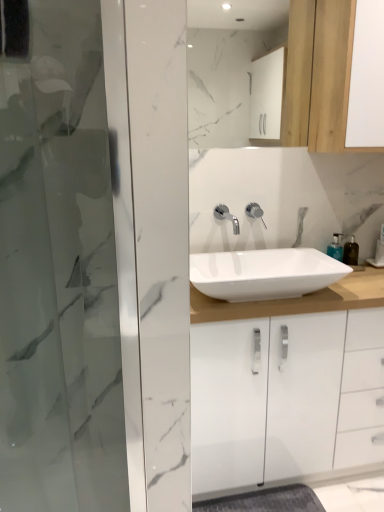
Question: Is white glossy sink at center thinner than polished chrome faucet at center, which ranks as the second tap in right-to-left order?

Choices:
 (A) no
 (B) yes

Answer: (A)

Question: Is white glossy sink at center to the right of polished chrome faucet at center, the first tap from the left, from the viewer's perspective?

Choices:
 (A) no
 (B) yes

Answer: (B)

Question: Considering the relative sizes of white glossy sink at center and polished chrome faucet at center, which ranks as the second tap in right-to-left order, in the image provided, is white glossy sink at center shorter than polished chrome faucet at center, which ranks as the second tap in right-to-left order,?

Choices:
 (A) yes
 (B) no

Answer: (A)

Question: Is white glossy sink at center bigger than polished chrome faucet at center, the first tap from the left?

Choices:
 (A) yes
 (B) no

Answer: (A)

Question: Would you say polished chrome faucet at center, the first tap from the left, is part of white glossy sink at center's contents?

Choices:
 (A) yes
 (B) no

Answer: (B)

Question: Is polished chrome faucet at center, arranged as the 1th tap when viewed from the right, inside the boundaries of white marble mirror at upper center, or outside?

Choices:
 (A) outside
 (B) inside

Answer: (A)

Question: Considering the relative positions of polished chrome faucet at center, arranged as the 1th tap when viewed from the right, and white marble mirror at upper center in the image provided, is polished chrome faucet at center, arranged as the 1th tap when viewed from the right, to the left or to the right of white marble mirror at upper center?

Choices:
 (A) left
 (B) right

Answer: (B)

Question: From a real-world perspective, is polished chrome faucet at center, arranged as the 1th tap when viewed from the right, physically located above or below white marble mirror at upper center?

Choices:
 (A) above
 (B) below

Answer: (B)

Question: From the image's perspective, is polished chrome faucet at center, arranged as the 1th tap when viewed from the right, above or below white marble mirror at upper center?

Choices:
 (A) above
 (B) below

Answer: (B)

Question: In terms of width, does translucent plastic soap dispenser at right, which is counted as the second soap dispenser, starting from the right, look wider or thinner when compared to white marble mirror at upper center?

Choices:
 (A) thin
 (B) wide

Answer: (B)

Question: In the image, is translucent plastic soap dispenser at right, which is counted as the second soap dispenser, starting from the right, positioned in front of or behind white marble mirror at upper center?

Choices:
 (A) behind
 (B) front

Answer: (A)

Question: From a real-world perspective, is translucent plastic soap dispenser at right, which is counted as the second soap dispenser, starting from the right, positioned above or below white marble mirror at upper center?

Choices:
 (A) below
 (B) above

Answer: (A)

Question: In terms of height, does translucent plastic soap dispenser at right, the first soap dispenser positioned from the left, look taller or shorter compared to white marble mirror at upper center?

Choices:
 (A) short
 (B) tall

Answer: (A)

Question: Would you say white marble mirror at upper center is inside or outside translucent plastic soap dispenser at right, the first soap dispenser positioned from the left?

Choices:
 (A) inside
 (B) outside

Answer: (B)

Question: Does point (236, 30) appear closer or farther from the camera than point (340, 260)?

Choices:
 (A) farther
 (B) closer

Answer: (A)